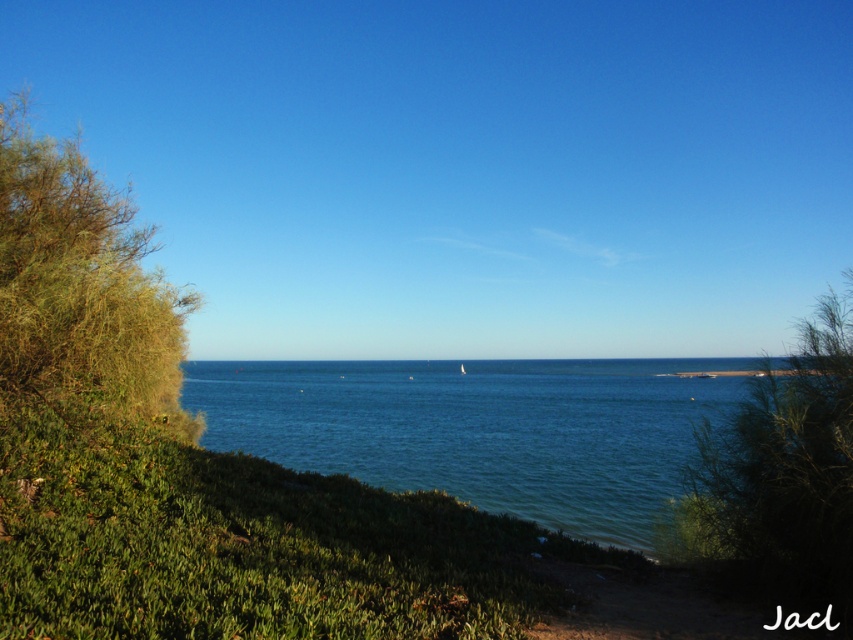
From the picture: Is green leafy shrub at left below green leafy shrub at center-right?

Indeed, green leafy shrub at left is positioned under green leafy shrub at center-right.

Does green leafy shrub at left appear over green leafy shrub at center-right?

Actually, green leafy shrub at left is below green leafy shrub at center-right.

Identify the location of green leafy shrub at left. This screenshot has height=640, width=853. (80, 289).

From the picture: Can you confirm if blue water at center is positioned to the left of green leafy shrub at left?

Incorrect, blue water at center is not on the left side of green leafy shrub at left.

Measure the distance between blue water at center and camera.

30.36 feet

Which is in front, point (577, 364) or point (93, 198)?

Positioned in front is point (93, 198).

Identify the location of blue water at center. The width and height of the screenshot is (853, 640). (483, 429).

Does point (657, 364) lie in front of point (824, 390)?

No, (657, 364) is further to viewer.

Does blue water at center have a smaller size compared to green leafy shrub at center-right?

Yes, blue water at center is smaller than green leafy shrub at center-right.

Who is more forward, [397,365] or [772,524]?

Positioned in front is point [772,524].

Locate an element on the screen. The image size is (853, 640). blue water at center is located at coordinates (483, 429).